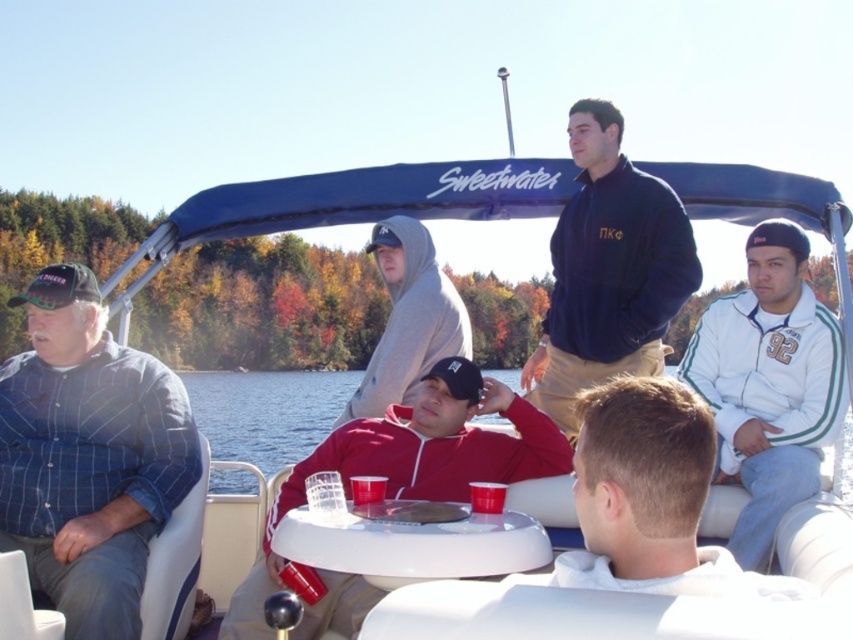
You are on the boat Sweetwater and need to identify clothing items. Which clothing item is positioned higher up between the navy blue fleece at center and the red fleece jacket at center?

The navy blue fleece at center is positioned above the red fleece jacket at center.